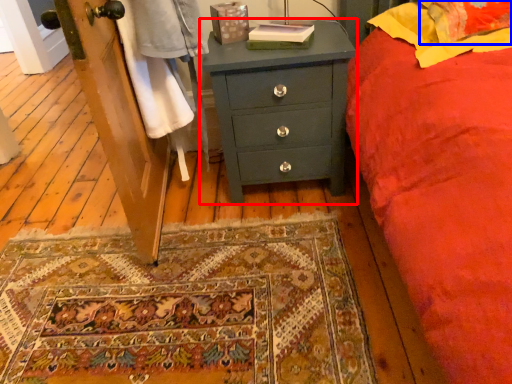
Question: Among these objects, which one is nearest to the camera, chest of drawers (highlighted by a red box) or pillow (highlighted by a blue box)?

Choices:
 (A) chest of drawers
 (B) pillow

Answer: (B)